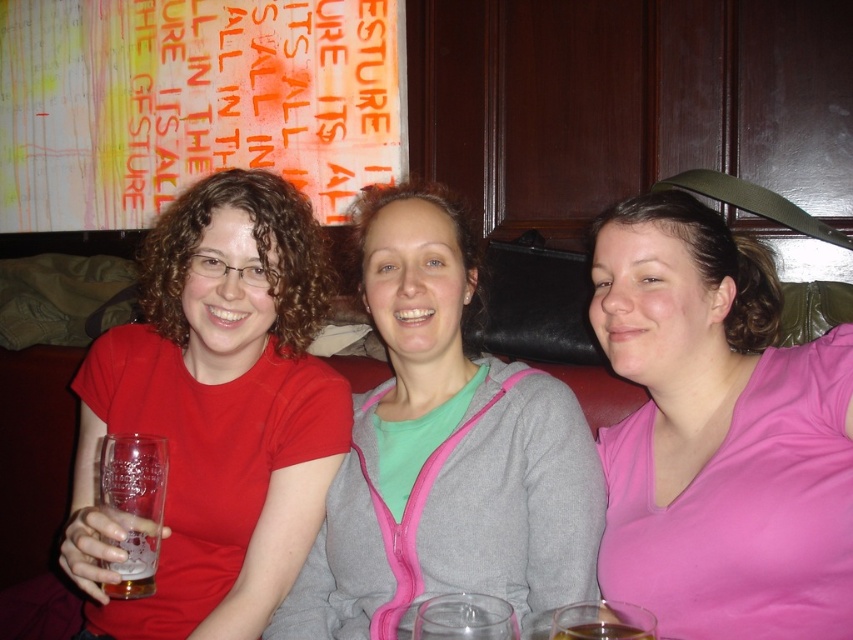
Question: Which object appears closest to the camera in this image?

Choices:
 (A) transparent glass at lower center
 (B) clear glass beer at left

Answer: (A)

Question: Can you confirm if orange fabric banner at upper left is smaller than clear glass beer at left?

Choices:
 (A) yes
 (B) no

Answer: (B)

Question: Is gray zip-up hoodie at center thinner than orange fabric banner at upper left?

Choices:
 (A) no
 (B) yes

Answer: (B)

Question: In this image, where is gray zip-up hoodie at center located relative to orange fabric banner at upper left?

Choices:
 (A) below
 (B) above

Answer: (A)

Question: Which point is farther to the camera?

Choices:
 (A) (714, 396)
 (B) (141, 577)

Answer: (A)

Question: Which object appears farthest from the camera in this image?

Choices:
 (A) transparent glass at lower center
 (B) orange fabric banner at upper left
 (C) brown liquid at lower center
 (D) matte glass at left

Answer: (B)